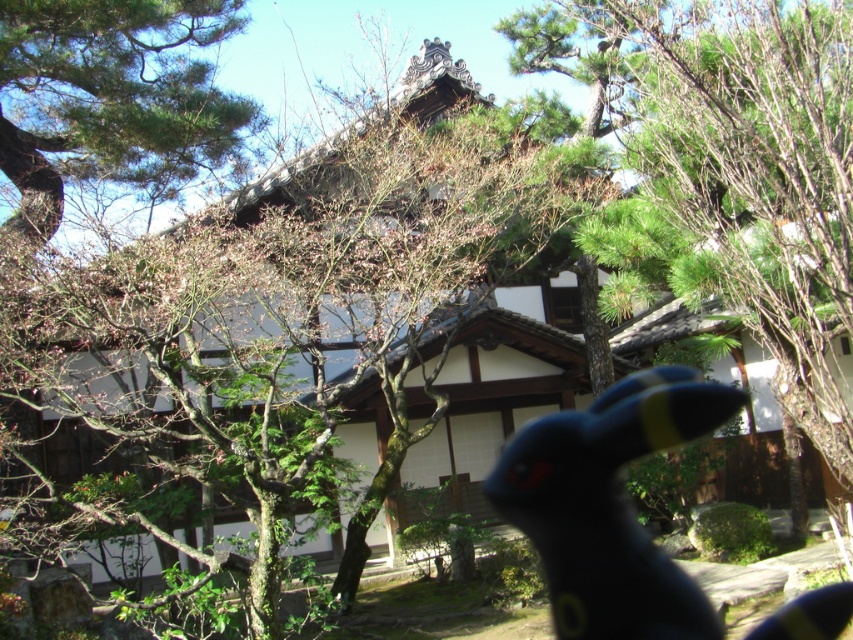
You are a photographer trying to capture a clear photo of the black rubber toy at center. The green leafy tree at center is blocking your view. Can you move the tree to get a better shot?

The green leafy tree at center is much taller than the black rubber toy at center, so it would be difficult to move the tree to get a better shot.

Looking at this image, you are taking a photo of the traditional Japanese building and the small black rabbit with yellow accents on its ears and a red eye. You want to focus on the rabbit while keeping the building in the background. Which of the two points, point (207, 42) or point (119, 83), should you focus on to ensure the rabbit is sharp?

You should focus on point (207, 42) because it is closer to the camera than point (119, 83), ensuring the rabbit is in focus while the building remains in the background.

You are standing in front of the traditional Japanese building and want to take a photo of the two green leafy trees. Which tree is positioned lower in the frame, the green leafy tree at center or the green leafy tree at upper left?

The green leafy tree at center is located below the green leafy tree at upper left, so it is positioned lower in the frame.